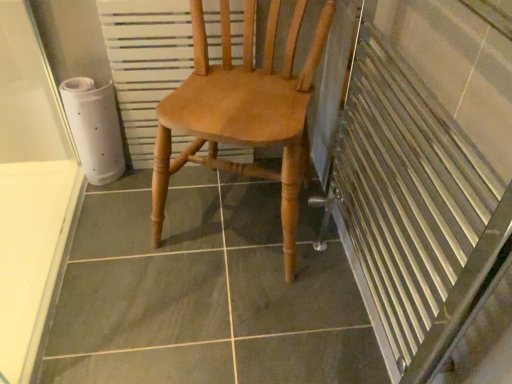
Locate an element on the screen. free area below light brown wood chair at center (from a real-world perspective) is located at coordinates (233, 210).